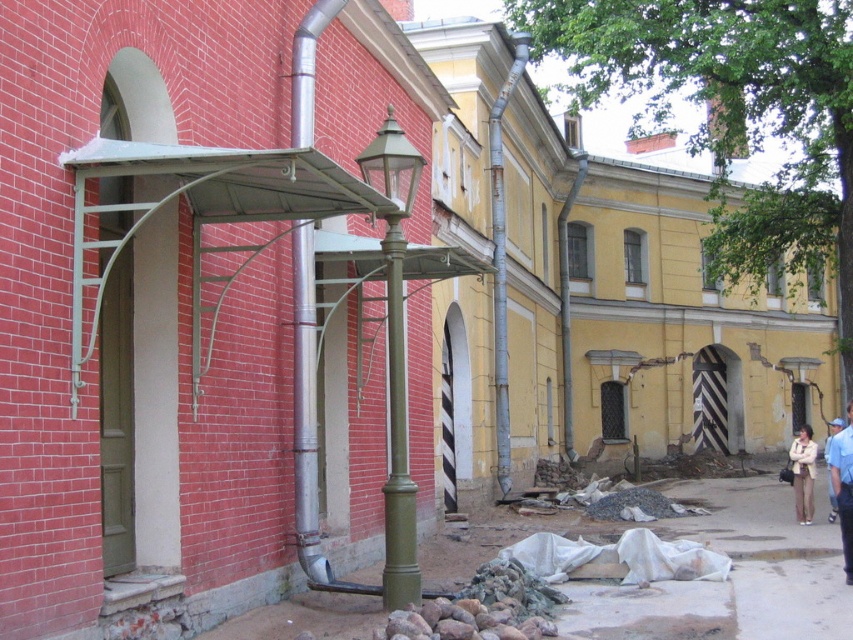
You are a delivery person trying to navigate between the two buildings. You need to pass through the narrow alley between them. The green polished metal pole at center and the light beige fabric coat at lower right are in your path. Which object will you have to duck under first?

The green polished metal pole at center is not as tall as the light beige fabric coat at lower right, so you will have to duck under the green polished metal pole at center first since it is shorter and comes before the taller coat in your path.

In the scene shown: You are a delivery person standing at the entrance of the yellow building with white trim. You need to deliver a package to the light blue uniform at lower right and the light beige fabric coat at lower right. Given that you can only carry one package at a time, which recipient should you visit first to minimize your walking distance?

You should visit the light blue uniform at lower right first because the distance between the two recipients is 10.45 meters, so delivering to one first and then the other requires walking the full distance. However, since you can choose the order, there is no difference in total distance. But if you start from the yellow building, the closer one would be better, but the description does not specify which is closer. Wait, the problem states that you need to minimize walking distance when carrying one at a a